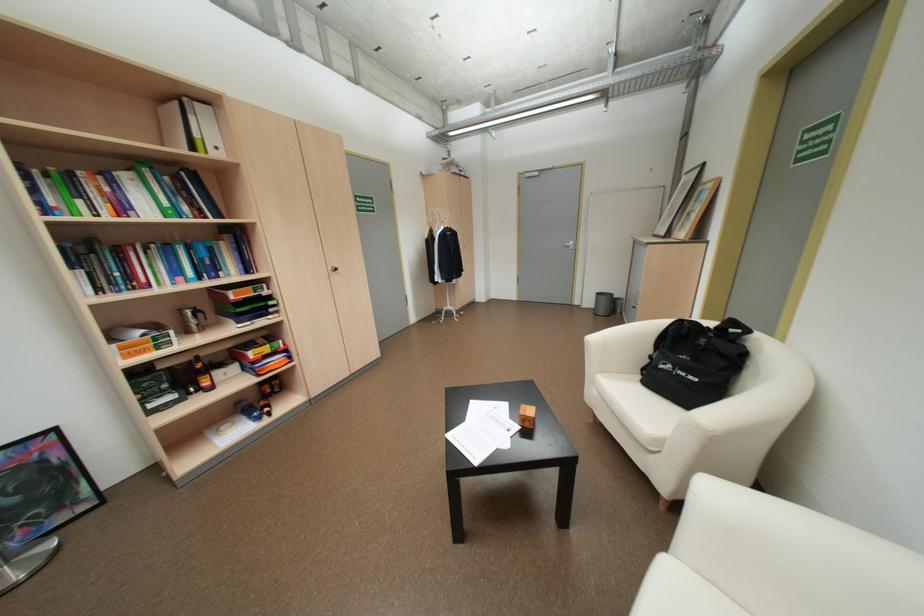
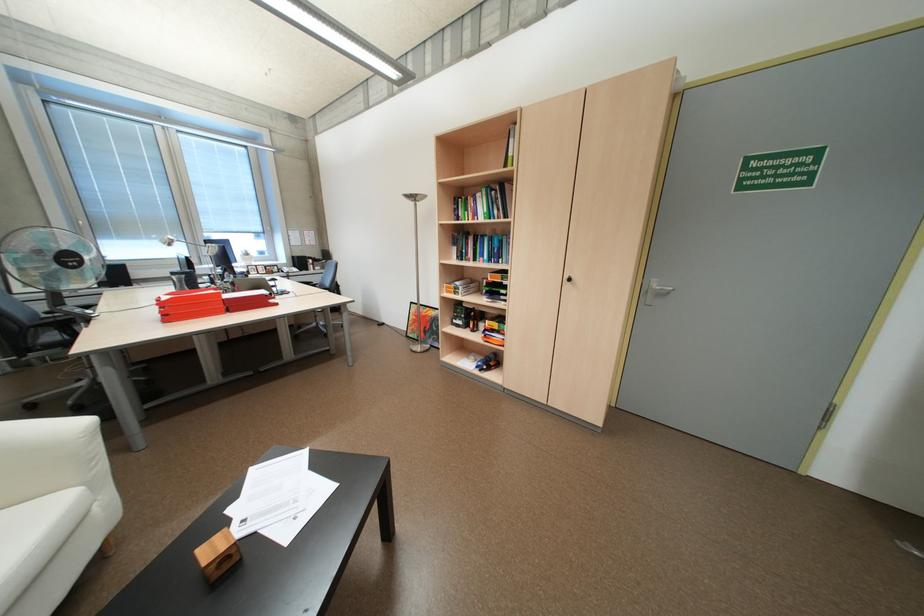
Where in the second image is the point corresponding to [167,347] from the first image?

(465, 293)